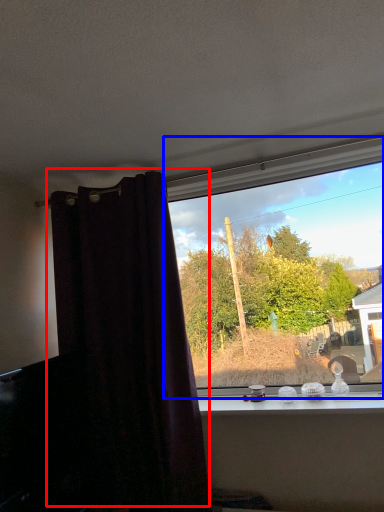
Question: Which of the following is the farthest to the observer, curtain (highlighted by a red box) or window (highlighted by a blue box)?

Choices:
 (A) curtain
 (B) window

Answer: (B)